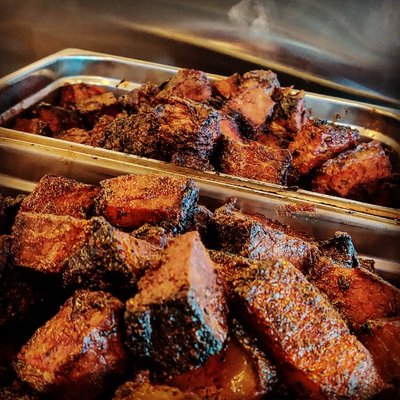
You are a GUI agent. You are given a task and a screenshot of the screen. Output one action in this format:
    pyautogui.click(x=<x>, y=<y>)
    Task: Click on the seasoning cluster
    The width and height of the screenshot is (400, 400).
    Given the screenshot: What is the action you would take?
    pyautogui.click(x=290, y=209)